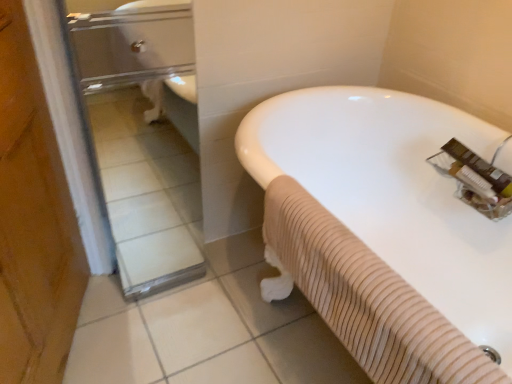
I want to click on vacant area that lies in front of clear glass door at left, so click(159, 332).